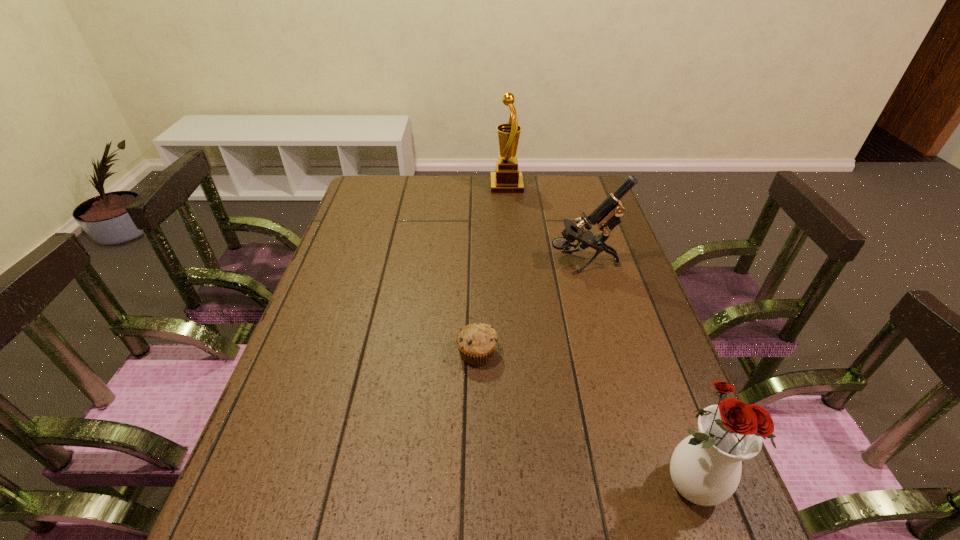
Where is `the tallest object`? the tallest object is located at coordinates (507, 179).

At what (x,y) coordinates should I click in order to perform the action: click on the farthest object. Please return your answer as a coordinate pair (x, y). The height and width of the screenshot is (540, 960). Looking at the image, I should click on (507, 179).

The width and height of the screenshot is (960, 540). Find the location of `the second farthest object`. the second farthest object is located at coordinates (606, 216).

This screenshot has width=960, height=540. Identify the location of vase. (705, 467).

Identify the location of the shortest object. click(x=476, y=342).

You are a GUI agent. You are given a task and a screenshot of the screen. Output one action in this format:
    pyautogui.click(x=<x>, y=<y>)
    Task: Click on the second nearest object
    
    Given the screenshot: What is the action you would take?
    pyautogui.click(x=476, y=342)

Image resolution: width=960 pixels, height=540 pixels. Identify the location of vacant space located 0.210m on the front-facing side of the award. (436, 186).

Identify the location of vacant space located 0.070m on the front-facing side of the award. Image resolution: width=960 pixels, height=540 pixels. (472, 186).

Find the location of a particular element. vacant region located on the front-facing side of the award is located at coordinates (425, 186).

Find the location of a particular element. The width and height of the screenshot is (960, 540). free spot located 0.110m through the eyepiece of the microscope is located at coordinates (514, 263).